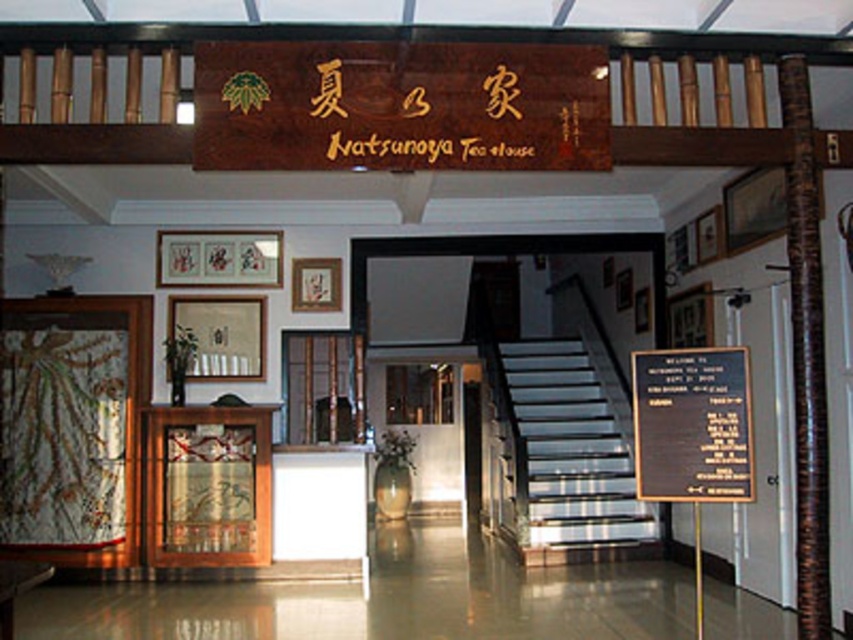
Question: Which of the following is the farthest from the observer?

Choices:
 (A) (706, 376)
 (B) (564, 468)

Answer: (B)

Question: Can you confirm if metallic staircase at center is thinner than black wood sign at center?

Choices:
 (A) yes
 (B) no

Answer: (B)

Question: Which point is farther to the camera?

Choices:
 (A) (613, 403)
 (B) (718, 365)

Answer: (A)

Question: Which of the following is the farthest from the observer?

Choices:
 (A) (527, 532)
 (B) (666, 376)

Answer: (A)

Question: Does metallic staircase at center have a smaller size compared to black wood sign at center?

Choices:
 (A) yes
 (B) no

Answer: (B)

Question: Is metallic staircase at center bigger than black wood sign at center?

Choices:
 (A) no
 (B) yes

Answer: (B)